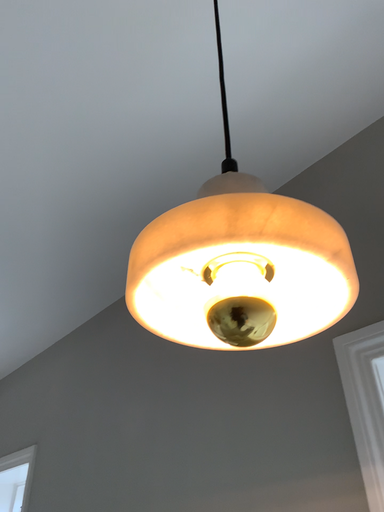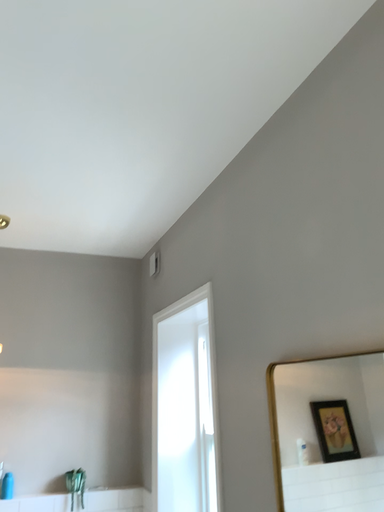
Question: How did the camera likely rotate when shooting the video?

Choices:
 (A) rotated downward
 (B) rotated upward

Answer: (A)